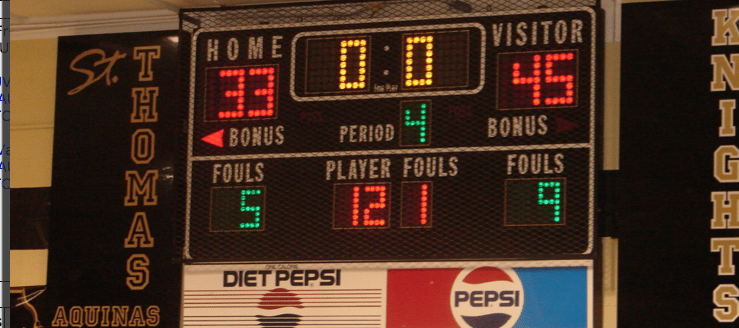
Where is `led lighting`? The image size is (739, 328). led lighting is located at coordinates (242, 97), (355, 77), (525, 98).